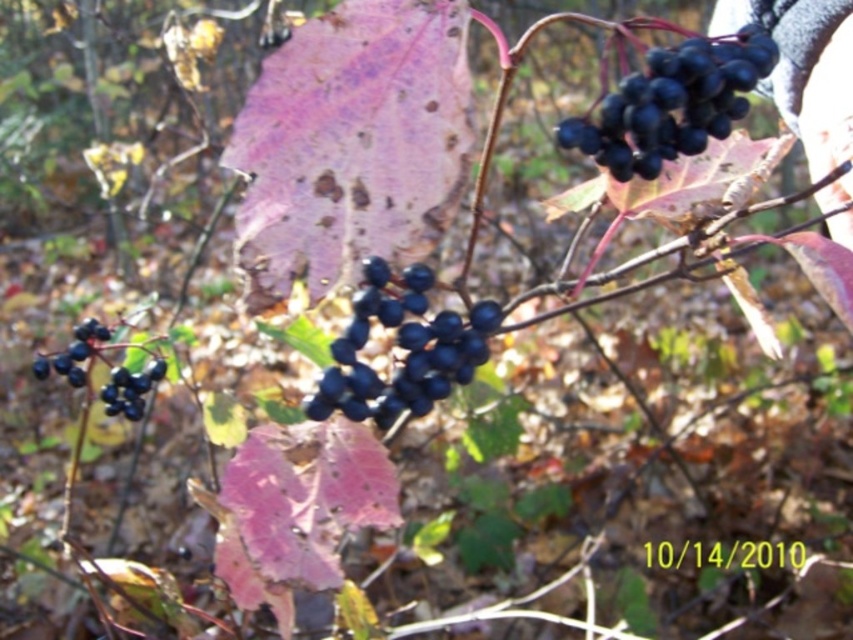
Can you confirm if shiny dark blue berries at lower left is wider than shiny dark blue berries at center-left?

Indeed, shiny dark blue berries at lower left has a greater width compared to shiny dark blue berries at center-left.

Is shiny dark blue berries at lower left positioned before shiny dark blue berries at center-left?

Yes, it is in front of shiny dark blue berries at center-left.

Does point (39, 356) come closer to viewer compared to point (111, 388)?

No, (39, 356) is behind (111, 388).

Image resolution: width=853 pixels, height=640 pixels. Identify the location of shiny dark blue berries at lower left. (108, 365).

Where is `glossy dark blue berries at center`? The width and height of the screenshot is (853, 640). glossy dark blue berries at center is located at coordinates (402, 348).

Is point (421, 385) less distant than point (131, 378)?

Yes, it is in front of point (131, 378).

Is point (407, 365) positioned in front of point (115, 380)?

Yes, point (407, 365) is in front of point (115, 380).

You are a GUI agent. You are given a task and a screenshot of the screen. Output one action in this format:
    pyautogui.click(x=<x>, y=<y>)
    Task: Click on the glossy dark blue berries at center
    The image size is (853, 640).
    Given the screenshot: What is the action you would take?
    pyautogui.click(x=402, y=348)

Is point (601, 74) closer to viewer compared to point (352, 314)?

That is True.

Between shiny black berries at upper right and glossy dark blue berries at center, which one is positioned higher?

shiny black berries at upper right is higher up.

Who is more forward, (770, 67) or (349, 332)?

Point (770, 67)

This screenshot has height=640, width=853. I want to click on shiny black berries at upper right, so click(x=671, y=104).